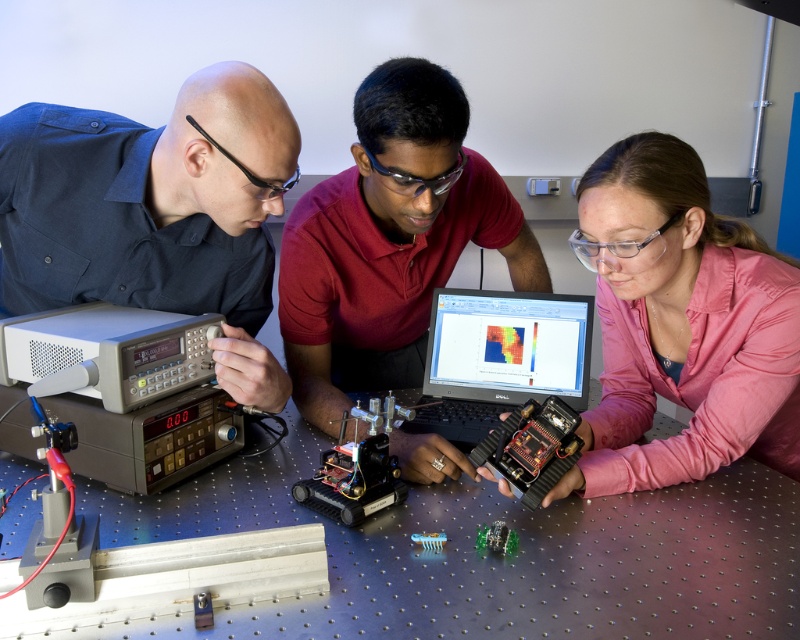
Does metallic silver table at center appear on the right side of black plastic circuit board at center?

In fact, metallic silver table at center is to the left of black plastic circuit board at center.

Is point (558, 520) farther from camera compared to point (480, 451)?

Yes, it is.

Is point (405, 515) less distant than point (552, 412)?

No, (405, 515) is behind (552, 412).

The height and width of the screenshot is (640, 800). What are the coordinates of `metallic silver table at center` in the screenshot? It's located at (494, 556).

Is matte black shirt at left shorter than pink fabric shirt at center?

Correct, matte black shirt at left is not as tall as pink fabric shirt at center.

Which is in front, point (284, 128) or point (729, 330)?

Point (284, 128)

You are a GUI agent. You are given a task and a screenshot of the screen. Output one action in this format:
    pyautogui.click(x=<x>, y=<y>)
    Task: Click on the matte black shirt at left
    The width and height of the screenshot is (800, 640).
    Given the screenshot: What is the action you would take?
    pyautogui.click(x=156, y=212)

I want to click on matte black shirt at left, so click(156, 212).

Does point (404, 440) come closer to viewer compared to point (100, 330)?

No.

This screenshot has width=800, height=640. What do you see at coordinates (389, 241) in the screenshot?
I see `matte red shirt at center` at bounding box center [389, 241].

Identify the location of matte red shirt at center. (389, 241).